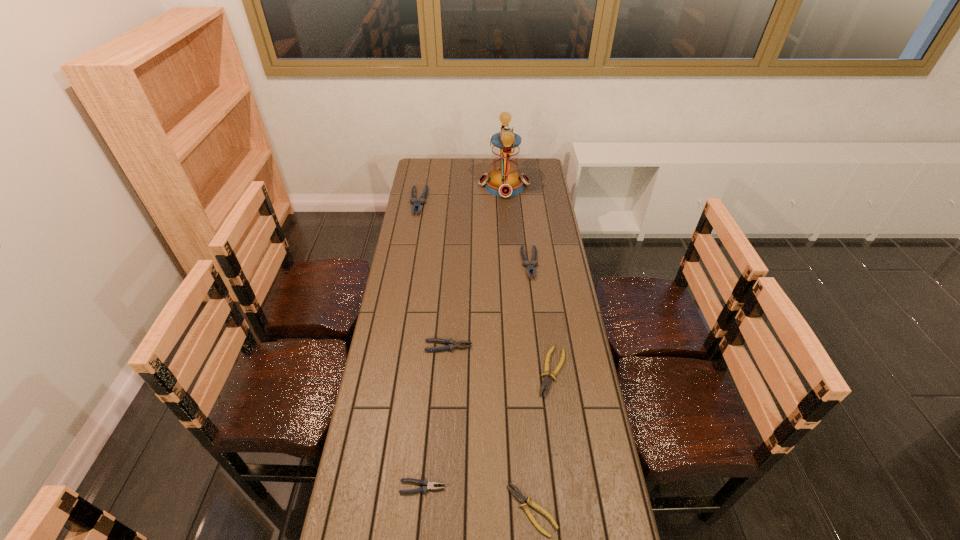
Locate an element on the screen. Image resolution: width=960 pixels, height=540 pixels. vacant point located between the farthest pliers and the shortest object is located at coordinates (475, 356).

The image size is (960, 540). Identify the location of empty location between the smallest gray pliers and the rightmost gray pliers. (476, 375).

Find the location of a particular element. blank region between the lantern and the third farthest object is located at coordinates (516, 225).

This screenshot has height=540, width=960. What are the coordinates of `unoccupied area between the nearest gray pliers and the second farthest gray pliers` in the screenshot? It's located at (476, 375).

Locate an element on the screen. This screenshot has width=960, height=540. unoccupied area between the nearest gray pliers and the farthest pliers is located at coordinates (420, 345).

Locate which object is the second closest to the third nearest gray pliers. Please provide its 2D coordinates. Your answer should be formatted as a tuple, i.e. [(x, y)], where the tuple contains the x and y coordinates of a point satisfying the conditions above.

[(504, 180)]

Point out which object is positioned as the nearest to the farthest gray pliers. Please provide its 2D coordinates. Your answer should be formatted as a tuple, i.e. [(x, y)], where the tuple contains the x and y coordinates of a point satisfying the conditions above.

[(504, 180)]

Locate an element on the screen. The width and height of the screenshot is (960, 540). pliers object that ranks as the second closest to the fifth shortest object is located at coordinates (452, 344).

Identify which pliers is located as the second nearest to the smallest gray pliers. Please provide its 2D coordinates. Your answer should be formatted as a tuple, i.e. [(x, y)], where the tuple contains the x and y coordinates of a point satisfying the conditions above.

[(546, 382)]

Locate an element on the screen. Image resolution: width=960 pixels, height=540 pixels. gray pliers identified as the third closest to the third tallest pliers is located at coordinates (413, 200).